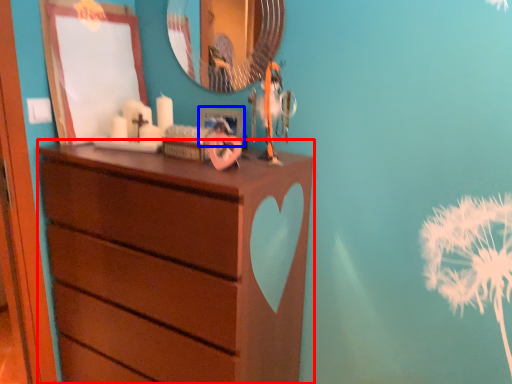
Question: Which point is closer to the camera, chest of drawers (highlighted by a red box) or picture frame (highlighted by a blue box)?

Choices:
 (A) chest of drawers
 (B) picture frame

Answer: (A)